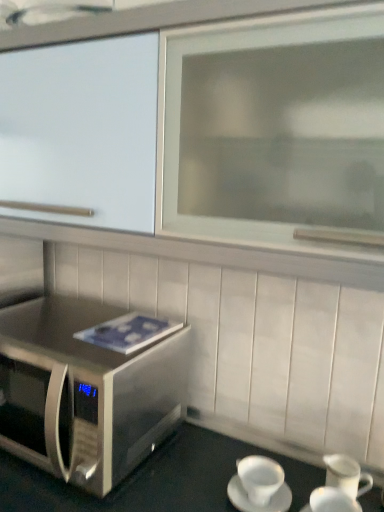
Question: In terms of height, does white ceramic cup at lower right, the first coffee cup positioned from the left, look taller or shorter compared to white ceramic coffee cup at lower right, which is counted as the 2th coffee cup, starting from the left?

Choices:
 (A) tall
 (B) short

Answer: (B)

Question: Is point (261, 458) positioned closer to the camera than point (354, 503)?

Choices:
 (A) farther
 (B) closer

Answer: (A)

Question: Considering the real-world distances, which object is closest to the stainless steel microwave at lower left?

Choices:
 (A) white ceramic coffee cup at lower right, which is counted as the 2th coffee cup, starting from the left
 (B) white ceramic cup at lower right, the first coffee cup positioned from the left
 (C) stainless steel microwave oven at lower left

Answer: (B)

Question: Which object is positioned farthest from the stainless steel microwave oven at lower left?

Choices:
 (A) white ceramic cup at lower right, marked as the second coffee cup in a right-to-left arrangement
 (B) stainless steel microwave at lower left
 (C) white ceramic coffee cup at lower right, which is counted as the 2th coffee cup, starting from the left

Answer: (C)